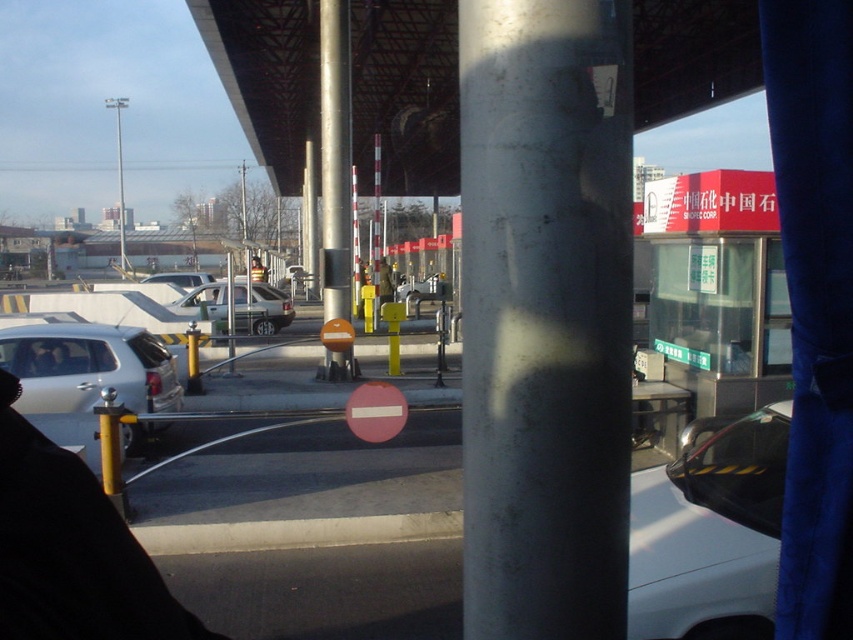
You are driving a car and approaching the checkpoint. You see the silver metallic pole at center and the silver metallic sedan at center. Which object is closer to you as you drive towards the checkpoint?

The silver metallic pole at center is closer to the viewer than the silver metallic sedan at center, so the pole would be closer as you drive towards the checkpoint.

You are driving a car and need to pass through the checkpoint. There is a silver metallic pole at center and a silver metallic sedan at center in your way. Can you safely drive around the pole and sedan to proceed?

The silver metallic pole at center is located above the silver metallic sedan at center, so you can safely drive around them as long as you stay within your lane and follow the traffic signals.

You are driving a car and approaching the checkpoint. You see the red matte stop sign at center and the matte silver sedan at center. Which object is located to the right of the other?

The red matte stop sign at center is positioned on the right side of matte silver sedan at center.